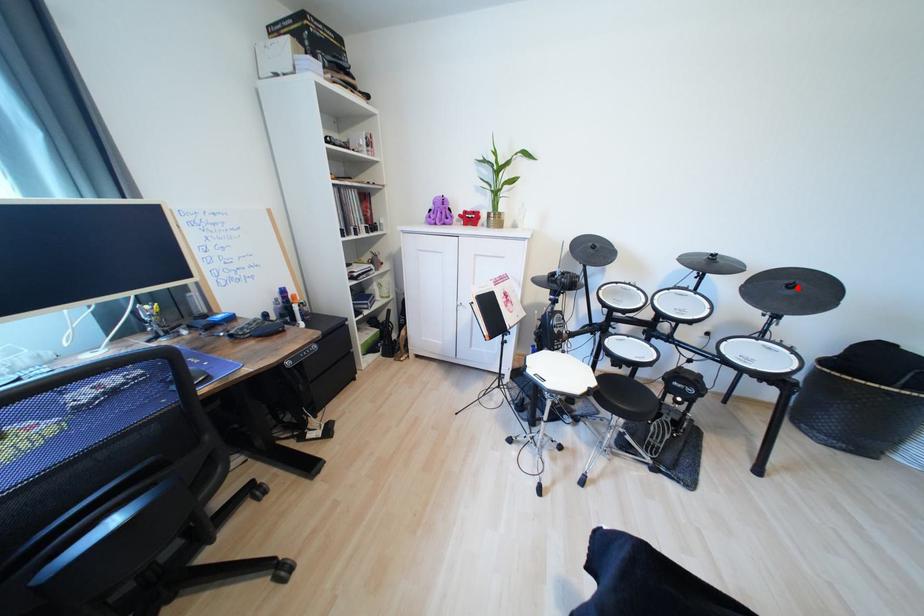
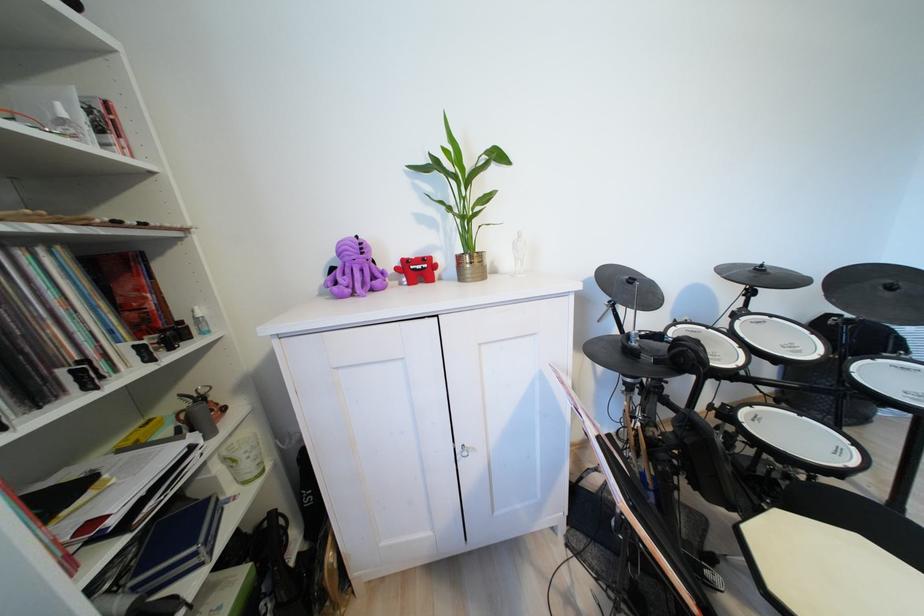
In the second image, find the point that corresponds to the highlighted location in the first image.

(897, 289)